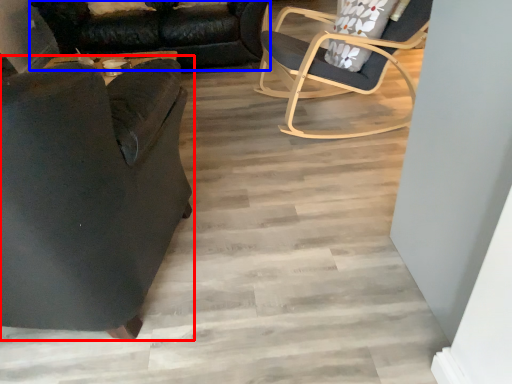
Question: Which point is further to the camera, chair (highlighted by a red box) or studio couch (highlighted by a blue box)?

Choices:
 (A) chair
 (B) studio couch

Answer: (B)